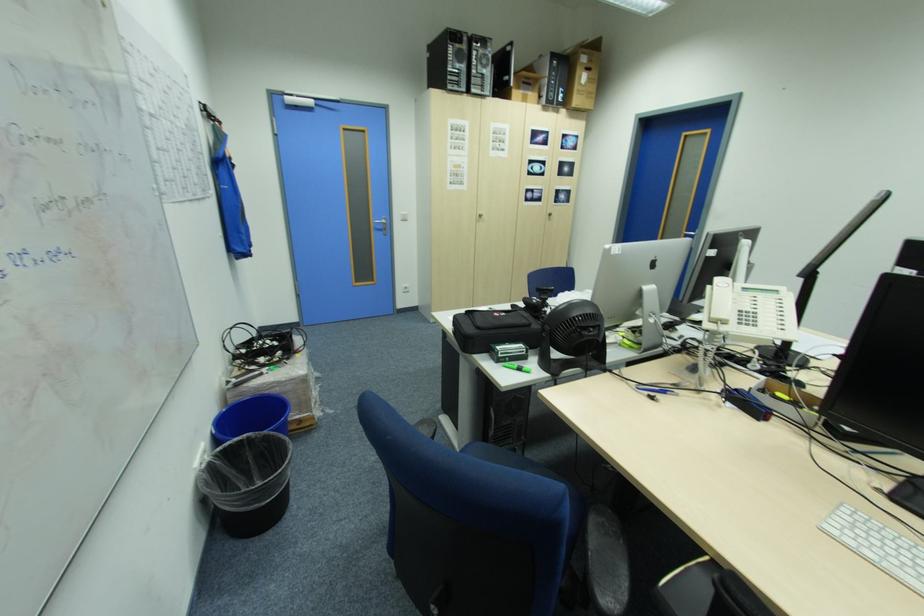
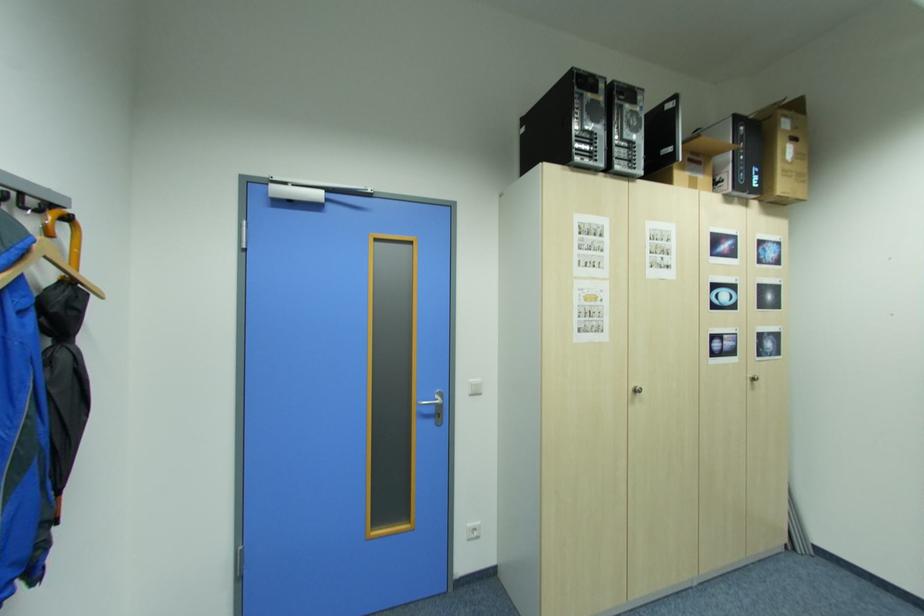
Locate, in the second image, the point that corresponds to pixel 410 286 in the first image.

(476, 529)